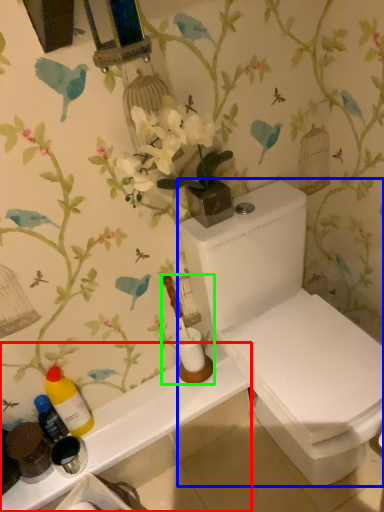
Question: Which is farther away from counter top (highlighted by a red box)? toilet (highlighted by a blue box) or toiletries (highlighted by a green box)?

Choices:
 (A) toilet
 (B) toiletries

Answer: (A)